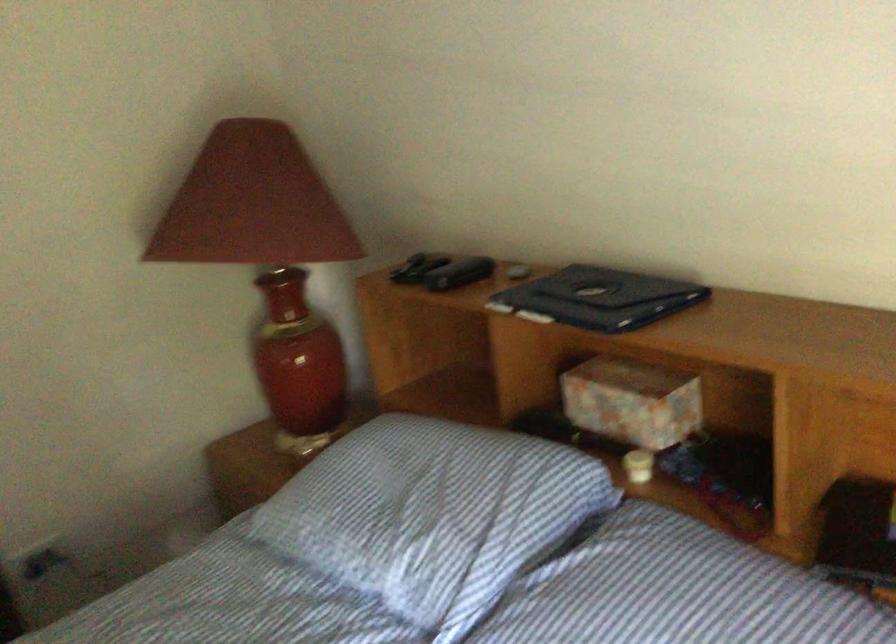
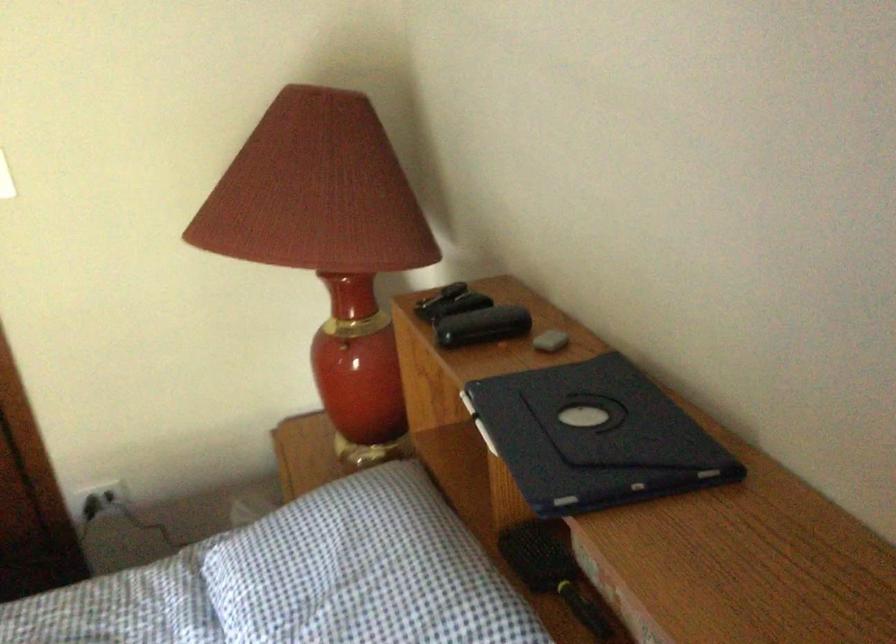
Where in the second image is the point corresponding to point 610,298 from the first image?

(593, 437)